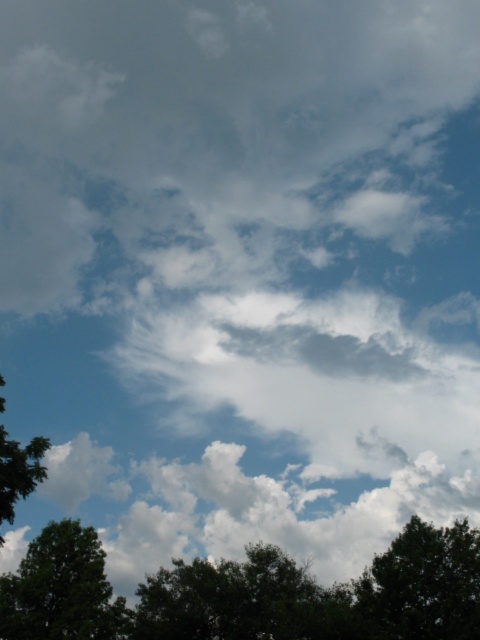
Question: Observing the image, what is the correct spatial positioning of green leafy tree at lower right in reference to green leafy tree at left?

Choices:
 (A) below
 (B) above

Answer: (A)

Question: Can you confirm if green leafy tree at lower center is positioned to the left of green leafy tree at left?

Choices:
 (A) no
 (B) yes

Answer: (A)

Question: Estimate the real-world distances between objects in this image. Which object is closer to the green leafy tree at lower left?

Choices:
 (A) green leafy tree at lower right
 (B) green leafy tree at left

Answer: (B)

Question: Which of the following is the farthest from the observer?

Choices:
 (A) green leafy tree at lower center
 (B) green leafy tree at lower left
 (C) green leafy tree at lower right
 (D) green leafy tree at left

Answer: (B)

Question: Can you confirm if green leafy tree at lower left is positioned to the right of green leafy tree at left?

Choices:
 (A) no
 (B) yes

Answer: (A)

Question: Which object appears farthest from the camera in this image?

Choices:
 (A) green leafy tree at left
 (B) green leafy tree at lower center

Answer: (B)